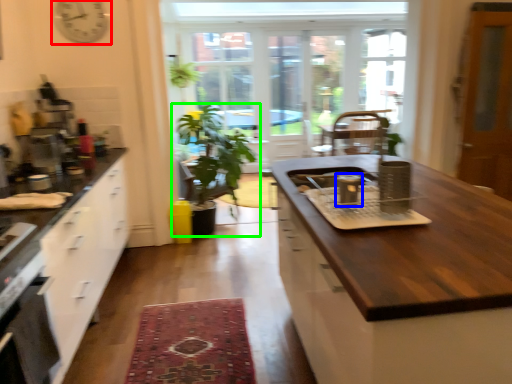
Question: Considering the real-world distances, which object is farthest from clock (highlighted by a red box)? appliance (highlighted by a blue box) or houseplant (highlighted by a green box)?

Choices:
 (A) appliance
 (B) houseplant

Answer: (A)